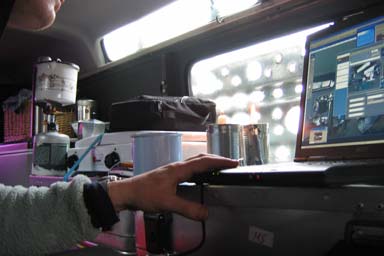
The image size is (384, 256). What are the coordinates of `hand on a keyboard` in the screenshot? It's located at (167, 180).